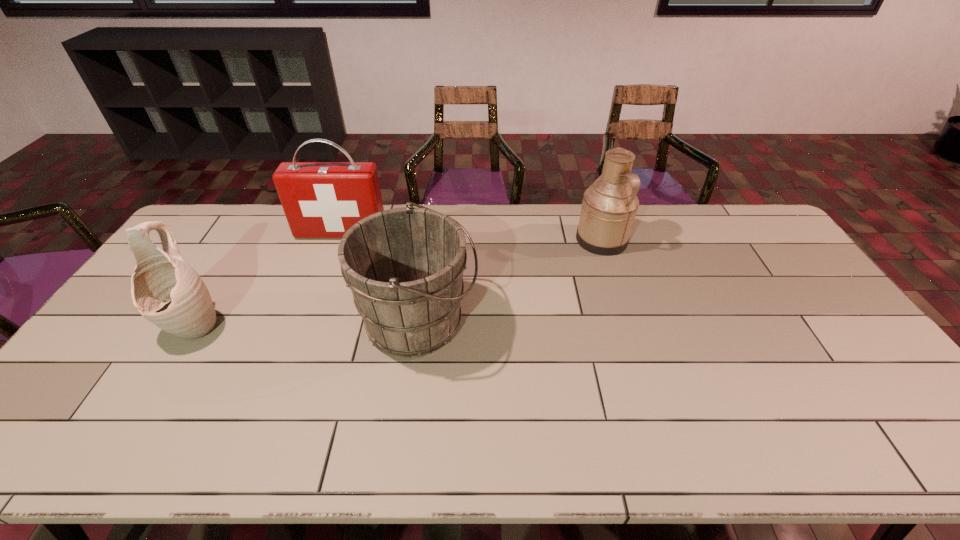
Find the location of a particular element. The image size is (960, 540). the first-aid kit that is at the far edge is located at coordinates (320, 199).

This screenshot has width=960, height=540. I want to click on pitcher that is at the far edge, so click(x=609, y=206).

This screenshot has height=540, width=960. I want to click on object located in the left edge section of the desktop, so click(165, 289).

Find the location of a particular element. This screenshot has width=960, height=540. vacant space at the far edge of the desktop is located at coordinates (266, 217).

This screenshot has width=960, height=540. I want to click on vacant space at the near edge, so click(x=334, y=453).

This screenshot has width=960, height=540. Identify the location of vacant space at the right edge of the desktop. [x=900, y=406].

You are a GUI agent. You are given a task and a screenshot of the screen. Output one action in this format:
    pyautogui.click(x=<x>, y=<y>)
    Task: Click on the free region at the far left corner of the desktop
    
    Given the screenshot: What is the action you would take?
    pyautogui.click(x=194, y=231)

Where is `vacant space at the far right corner of the desktop`? vacant space at the far right corner of the desktop is located at coordinates (743, 213).

This screenshot has width=960, height=540. Find the location of `free area in between the bucket and the farther pitcher`. free area in between the bucket and the farther pitcher is located at coordinates (510, 281).

Where is `free space between the bucket and the rightmost object`? Image resolution: width=960 pixels, height=540 pixels. free space between the bucket and the rightmost object is located at coordinates [510, 281].